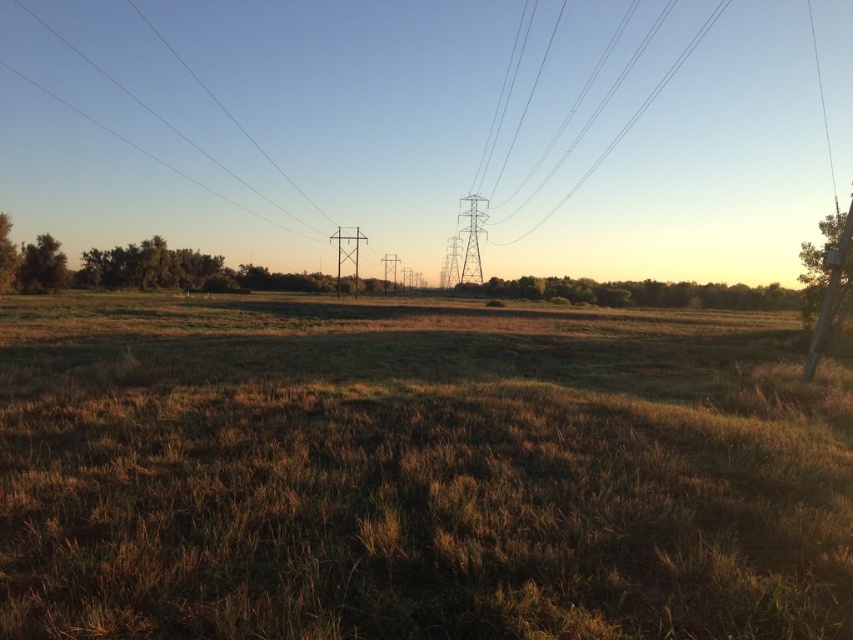
You are standing in the middle of the grassy field in the rural landscape. You want to walk towards the green leafy tree at right. Which direction should you head?

You should head towards the right direction to reach the green leafy tree at right as it is located at the right side of the scene.

You are a bird looking for a place to perch. You see the green leafy tree at left and the black wire at upper center. Which one is smaller in size?

The green leafy tree at left is smaller in size compared to the black wire at upper center.

You are a hiker who wants to take a photo of the green leafy tree at left. You are currently standing on the brown dry grass at center. Which direction should you move to get a clear view of the tree?

The brown dry grass at center is below the green leafy tree at left, so you should move upwards from the brown dry grass at center to get a clear view of the green leafy tree at left.